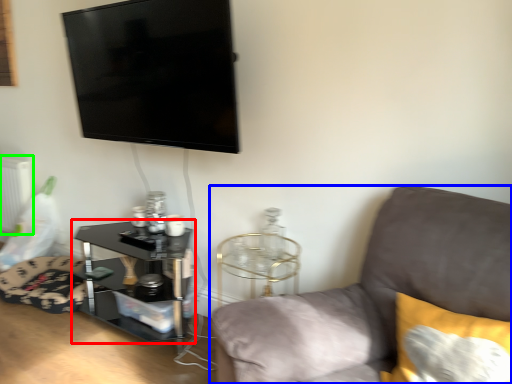
Question: Considering the real-world distances, which object is closest to table (highlighted by a red box)? studio couch (highlighted by a blue box) or radiator (highlighted by a green box).

Choices:
 (A) studio couch
 (B) radiator

Answer: (A)